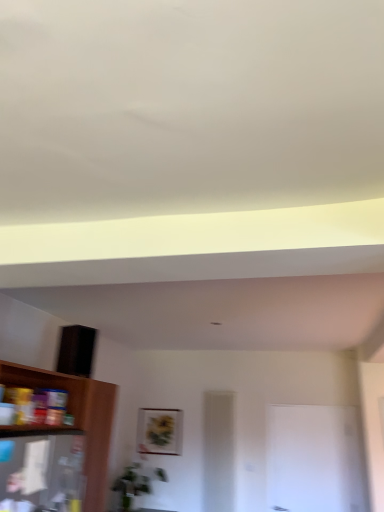
Question: Does matte gold picture frame at center appear on the right side of wooden shelf at lower left?

Choices:
 (A) no
 (B) yes

Answer: (B)

Question: Is the depth of matte gold picture frame at center greater than that of wooden shelf at lower left?

Choices:
 (A) no
 (B) yes

Answer: (B)

Question: Is matte gold picture frame at center not within wooden shelf at lower left?

Choices:
 (A) yes
 (B) no

Answer: (B)

Question: Considering the relative sizes of matte gold picture frame at center and wooden shelf at lower left in the image provided, is matte gold picture frame at center smaller than wooden shelf at lower left?

Choices:
 (A) no
 (B) yes

Answer: (B)

Question: Is matte gold picture frame at center positioned with its back to wooden shelf at lower left?

Choices:
 (A) yes
 (B) no

Answer: (B)

Question: Relative to matte gold picture frame at center, is white glossy door at center in front or behind?

Choices:
 (A) behind
 (B) front

Answer: (B)

Question: In terms of height, does white glossy door at center look taller or shorter compared to matte gold picture frame at center?

Choices:
 (A) short
 (B) tall

Answer: (B)

Question: From a real-world perspective, relative to matte gold picture frame at center, is white glossy door at center vertically above or below?

Choices:
 (A) above
 (B) below

Answer: (B)

Question: Does point (301, 442) appear closer or farther from the camera than point (158, 434)?

Choices:
 (A) farther
 (B) closer

Answer: (B)

Question: Visually, is wooden shelf at lower left positioned to the left or to the right of white glossy door at center?

Choices:
 (A) right
 (B) left

Answer: (B)

Question: Is wooden shelf at lower left in front of or behind white glossy door at center in the image?

Choices:
 (A) front
 (B) behind

Answer: (A)

Question: From their relative heights in the image, would you say wooden shelf at lower left is taller or shorter than white glossy door at center?

Choices:
 (A) short
 (B) tall

Answer: (B)

Question: From a real-world perspective, is wooden shelf at lower left physically located above or below white glossy door at center?

Choices:
 (A) below
 (B) above

Answer: (A)

Question: Based on their sizes in the image, would you say wooden shelf at lower left is bigger or smaller than matte gold picture frame at center?

Choices:
 (A) big
 (B) small

Answer: (A)

Question: From a real-world perspective, is wooden shelf at lower left physically located above or below matte gold picture frame at center?

Choices:
 (A) below
 (B) above

Answer: (A)